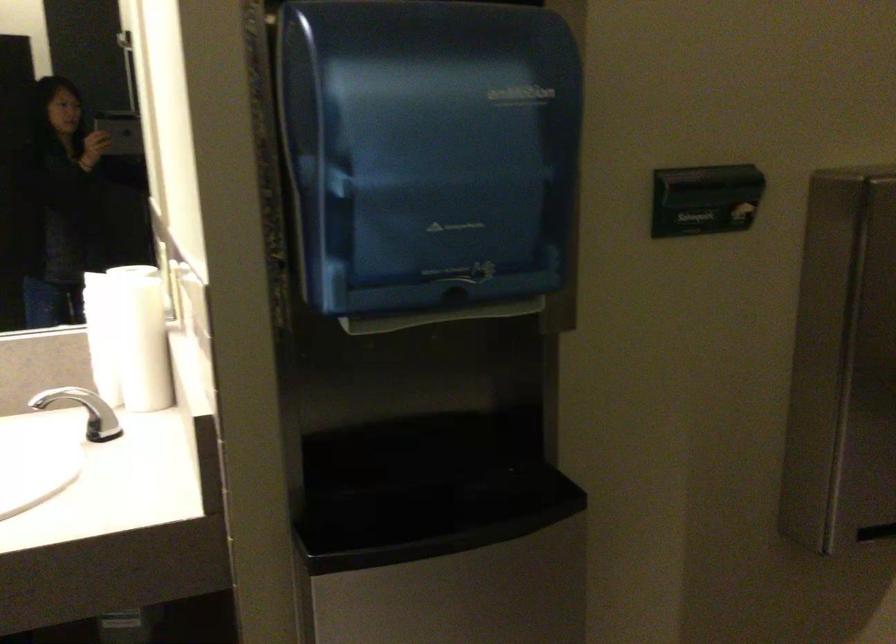
Identify the location of white paper towel roll. (128, 337).